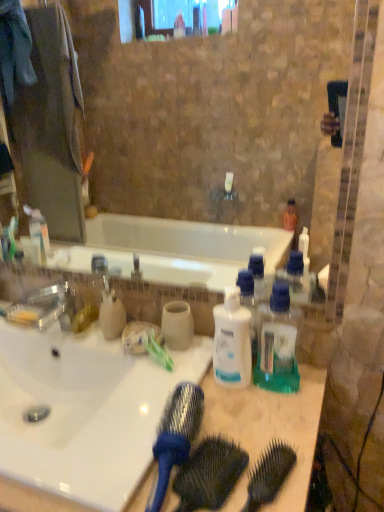
Find the location of a particular element. vacant space positioned to the left of black plastic brush at center, marked as the second brush in a left-to-right arrangement is located at coordinates (132, 470).